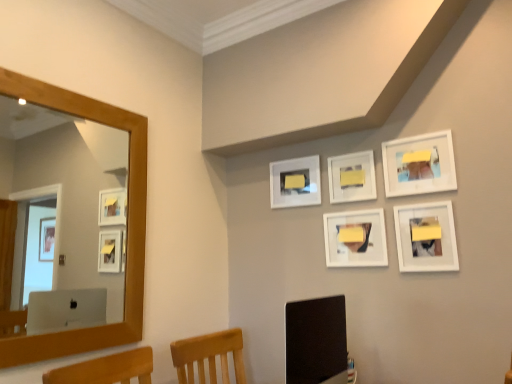
The image size is (512, 384). What do you see at coordinates (355, 238) in the screenshot?
I see `white matte picture frame at center, marked as the fourth picture frame in a right-to-left arrangement` at bounding box center [355, 238].

What do you see at coordinates (295, 182) in the screenshot?
I see `white matte picture frame at upper center, which is the first picture frame in left-to-right order` at bounding box center [295, 182].

In order to click on white matte picture frame at center, which is the 2th picture frame from left to right in this screenshot , I will do `click(355, 238)`.

Is matte black monitor at lower center a part of wooden mirror at left?

No, matte black monitor at lower center is located outside of wooden mirror at left.

Who is shorter, wooden mirror at left or matte black monitor at lower center?

matte black monitor at lower center is shorter.

Who is bigger, wooden mirror at left or matte black monitor at lower center?

Bigger between the two is matte black monitor at lower center.

From the image's perspective, relative to matte black monitor at lower center, is wooden mirror at left above or below?

wooden mirror at left is above matte black monitor at lower center.

Does white matte picture frame at upper center, the fifth picture frame viewed from the right, have a greater width compared to matte black monitor at lower center?

In fact, white matte picture frame at upper center, the fifth picture frame viewed from the right, might be narrower than matte black monitor at lower center.

From a real-world perspective, is white matte picture frame at upper center, the fifth picture frame viewed from the right, physically above matte black monitor at lower center?

Yes.

From the image's perspective, is white matte picture frame at upper center, the fifth picture frame viewed from the right, located beneath matte black monitor at lower center?

No, from the image's perspective, white matte picture frame at upper center, the fifth picture frame viewed from the right, is not below matte black monitor at lower center.

Is white matte picture frame at upper center, which is the first picture frame in left-to-right order, shorter than white matte picture frame at upper right, which is the 2th picture frame in right-to-left order?

Correct, white matte picture frame at upper center, which is the first picture frame in left-to-right order, is not as tall as white matte picture frame at upper right, which is the 2th picture frame in right-to-left order.

Could you tell me if white matte picture frame at upper center, the fifth picture frame viewed from the right, is facing white matte picture frame at upper right, which is the 2th picture frame in right-to-left order?

No, white matte picture frame at upper center, the fifth picture frame viewed from the right, is not facing towards white matte picture frame at upper right, which is the 2th picture frame in right-to-left order.

Considering the relative positions of white matte picture frame at upper center, which is the first picture frame in left-to-right order, and white matte picture frame at upper right, which is the 2th picture frame in right-to-left order, in the image provided, is white matte picture frame at upper center, which is the first picture frame in left-to-right order, in front of white matte picture frame at upper right, which is the 2th picture frame in right-to-left order,?

No.

Is white matte picture frame at upper center, the fifth picture frame viewed from the right, directly adjacent to white matte picture frame at upper right, which is the 2th picture frame in right-to-left order?

No, white matte picture frame at upper center, the fifth picture frame viewed from the right, is not next to white matte picture frame at upper right, which is the 2th picture frame in right-to-left order.

Is white matte picture frame at center, arranged as the third picture frame when viewed from the right, oriented towards white matte picture frame at center, which is the 2th picture frame from left to right?

No, white matte picture frame at center, arranged as the third picture frame when viewed from the right, does not turn towards white matte picture frame at center, which is the 2th picture frame from left to right.

Is point (371, 195) positioned before point (347, 250)?

Yes, it is.

Which picture frame is the 1st one when counting from the back of the white matte picture frame at center, which is the 2th picture frame from left to right? Please provide its 2D coordinates.

[(352, 177)]

Is white matte picture frame at center, arranged as the third picture frame when viewed from the right, next to white matte picture frame at center, which is the 2th picture frame from left to right, and touching it?

white matte picture frame at center, arranged as the third picture frame when viewed from the right, is not next to white matte picture frame at center, which is the 2th picture frame from left to right, and they're not touching.

Image resolution: width=512 pixels, height=384 pixels. Identify the location of the 4th picture frame behind the white matte picture frame at lower right, the 5th picture frame viewed from the left, starting your count from the anchor. pyautogui.click(x=295, y=182).

In the scene shown: Can you confirm if white matte picture frame at upper center, which is the first picture frame in left-to-right order, is shorter than white matte picture frame at lower right, the first picture frame positioned from the right?

Indeed, white matte picture frame at upper center, which is the first picture frame in left-to-right order, has a lesser height compared to white matte picture frame at lower right, the first picture frame positioned from the right.

Is white matte picture frame at upper center, the fifth picture frame viewed from the right, further to camera compared to white matte picture frame at lower right, the 5th picture frame viewed from the left?

Yes, white matte picture frame at upper center, the fifth picture frame viewed from the right, is further from the camera.

Is white matte picture frame at center, arranged as the third picture frame when viewed from the right, facing towards matte black monitor at lower center?

No, white matte picture frame at center, arranged as the third picture frame when viewed from the right, is not turned towards matte black monitor at lower center.

Based on the photo, which is more to the right, white matte picture frame at center, the third picture frame when ordered from left to right, or matte black monitor at lower center?

From the viewer's perspective, white matte picture frame at center, the third picture frame when ordered from left to right, appears more on the right side.

Which is correct: white matte picture frame at center, arranged as the third picture frame when viewed from the right, is inside matte black monitor at lower center, or outside of it?

white matte picture frame at center, arranged as the third picture frame when viewed from the right, exists outside the volume of matte black monitor at lower center.

Between white matte picture frame at center, arranged as the third picture frame when viewed from the right, and matte black monitor at lower center, which one has larger size?

matte black monitor at lower center.

From a real-world perspective, is white matte picture frame at center, marked as the fourth picture frame in a right-to-left arrangement, on top of white matte picture frame at lower right, the 5th picture frame viewed from the left?

Yes, from a real-world perspective, white matte picture frame at center, marked as the fourth picture frame in a right-to-left arrangement, is above white matte picture frame at lower right, the 5th picture frame viewed from the left.

From the image's perspective, is white matte picture frame at center, which is the 2th picture frame from left to right, beneath white matte picture frame at lower right, the first picture frame positioned from the right?

Yes, from the image's perspective, white matte picture frame at center, which is the 2th picture frame from left to right, is beneath white matte picture frame at lower right, the first picture frame positioned from the right.

Which object is thinner, white matte picture frame at center, marked as the fourth picture frame in a right-to-left arrangement, or white matte picture frame at lower right, the first picture frame positioned from the right?

With smaller width is white matte picture frame at lower right, the first picture frame positioned from the right.

The image size is (512, 384). Identify the location of the 3rd picture frame to the left of the white matte picture frame at lower right, the 5th picture frame viewed from the left, counting from the anchor's position. (355, 238).

The width and height of the screenshot is (512, 384). In the image, there is a matte black monitor at lower center. Find the location of `mirror above it (from the image's perspective)`. mirror above it (from the image's perspective) is located at coordinates (64, 215).

Locate an element on the screen. computer monitor below the white matte picture frame at upper center, which is the first picture frame in left-to-right order (from a real-world perspective) is located at coordinates (315, 340).

Based on their spatial positions, is white matte picture frame at center, arranged as the third picture frame when viewed from the right, or wooden mirror at left further from white matte picture frame at upper right, which is the 2th picture frame in right-to-left order?

wooden mirror at left is positioned further to the anchor white matte picture frame at upper right, which is the 2th picture frame in right-to-left order.

Consider the image. Looking at the image, which one is located closer to white matte picture frame at upper right, acting as the fourth picture frame starting from the left, white matte picture frame at center, which is the 2th picture frame from left to right, or wooden mirror at left?

Among the two, white matte picture frame at center, which is the 2th picture frame from left to right, is located nearer to white matte picture frame at upper right, acting as the fourth picture frame starting from the left.

When comparing their distances from white matte picture frame at center, marked as the fourth picture frame in a right-to-left arrangement, does white matte picture frame at upper center, the fifth picture frame viewed from the right, or matte black monitor at lower center seem closer?

Among the two, white matte picture frame at upper center, the fifth picture frame viewed from the right, is located nearer to white matte picture frame at center, marked as the fourth picture frame in a right-to-left arrangement.

Considering their positions, is white matte picture frame at center, marked as the fourth picture frame in a right-to-left arrangement, positioned closer to white matte picture frame at lower right, the 5th picture frame viewed from the left, than white matte picture frame at upper right, acting as the fourth picture frame starting from the left?

white matte picture frame at center, marked as the fourth picture frame in a right-to-left arrangement, lies closer to white matte picture frame at lower right, the 5th picture frame viewed from the left, than the other object.

Based on the photo, estimate the real-world distances between objects in this image. Which object is further from white matte picture frame at center, the third picture frame when ordered from left to right, white matte picture frame at center, marked as the fourth picture frame in a right-to-left arrangement, or white matte picture frame at upper right, acting as the fourth picture frame starting from the left?

The object further to white matte picture frame at center, the third picture frame when ordered from left to right, is white matte picture frame at upper right, acting as the fourth picture frame starting from the left.

Considering their positions, is matte black monitor at lower center positioned closer to white matte picture frame at upper center, which is the first picture frame in left-to-right order, than white matte picture frame at center, arranged as the third picture frame when viewed from the right?

The object closer to white matte picture frame at upper center, which is the first picture frame in left-to-right order, is white matte picture frame at center, arranged as the third picture frame when viewed from the right.

When comparing their distances from white matte picture frame at lower right, the first picture frame positioned from the right, does white matte picture frame at center, arranged as the third picture frame when viewed from the right, or matte black monitor at lower center seem closer?

white matte picture frame at center, arranged as the third picture frame when viewed from the right, is positioned closer to the anchor white matte picture frame at lower right, the first picture frame positioned from the right.

Based on their spatial positions, is white matte picture frame at center, the third picture frame when ordered from left to right, or white matte picture frame at center, which is the 2th picture frame from left to right, closer to matte black monitor at lower center?

white matte picture frame at center, which is the 2th picture frame from left to right, is positioned closer to the anchor matte black monitor at lower center.

This screenshot has width=512, height=384. Find the location of `computer monitor between wooden mirror at left and white matte picture frame at center, which is the 2th picture frame from left to right`. computer monitor between wooden mirror at left and white matte picture frame at center, which is the 2th picture frame from left to right is located at coordinates (315, 340).

Identify the location of picture frame between wooden mirror at left and white matte picture frame at center, marked as the fourth picture frame in a right-to-left arrangement, from left to right. This screenshot has height=384, width=512. (295, 182).

Locate an element on the screen. The height and width of the screenshot is (384, 512). computer monitor situated between wooden mirror at left and white matte picture frame at center, arranged as the third picture frame when viewed from the right, from left to right is located at coordinates (315, 340).

This screenshot has width=512, height=384. What are the coordinates of `computer monitor between wooden mirror at left and white matte picture frame at upper center, the fifth picture frame viewed from the right` in the screenshot? It's located at [315, 340].